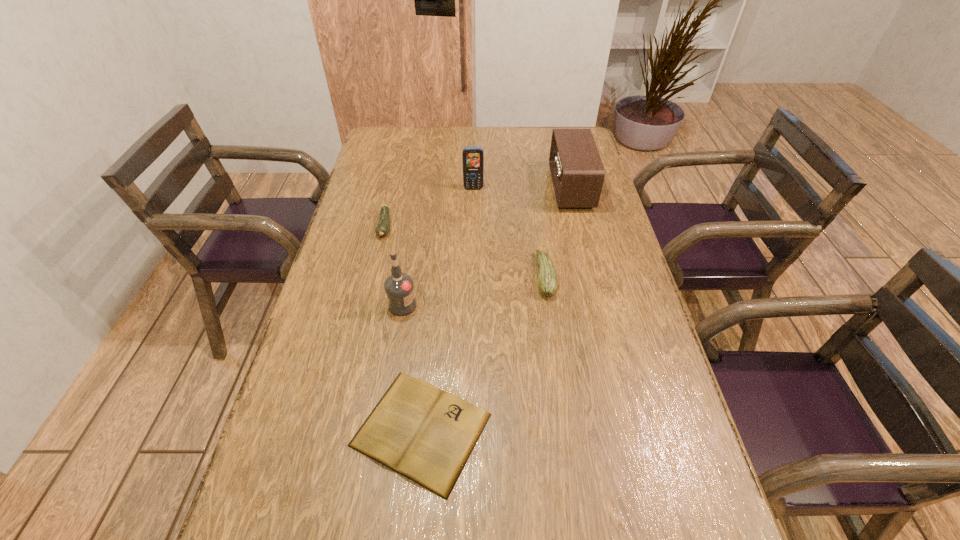
I want to click on vacant space that satisfies the following two spatial constraints: 1. at the blossom end of the shorter zucchini; 2. on the right side of the nearest object, so click(338, 430).